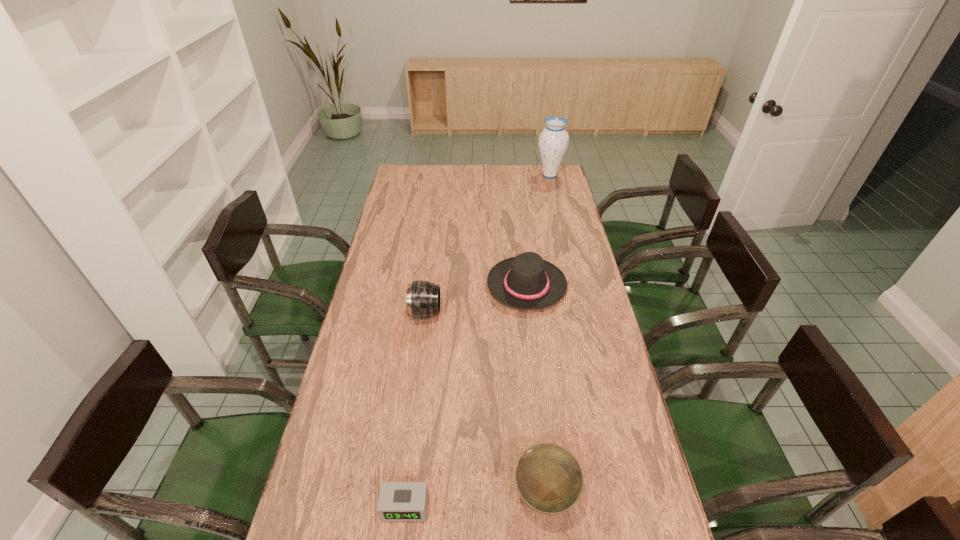
Where is `free area in between the bowl and the telephoto lens`? Image resolution: width=960 pixels, height=540 pixels. free area in between the bowl and the telephoto lens is located at coordinates (485, 404).

What are the coordinates of `vacant area between the dress hat and the bowl` in the screenshot? It's located at (x=536, y=390).

Find the location of `vacant space in between the bowl and the alarm clock`. vacant space in between the bowl and the alarm clock is located at coordinates (475, 501).

The height and width of the screenshot is (540, 960). I want to click on vacant space that is in between the bowl and the alarm clock, so click(475, 501).

You are a GUI agent. You are given a task and a screenshot of the screen. Output one action in this format:
    pyautogui.click(x=<x>, y=<y>)
    Task: Click on the vacant space that's between the vase and the bowl
    The image size is (960, 540).
    Given the screenshot: What is the action you would take?
    pyautogui.click(x=547, y=335)

You are a GUI agent. You are given a task and a screenshot of the screen. Output one action in this format:
    pyautogui.click(x=<x>, y=<y>)
    Task: Click on the free spot between the farthest object and the alarm clock
    This screenshot has height=540, width=960.
    Given the screenshot: What is the action you would take?
    pyautogui.click(x=477, y=341)

Locate an element on the screen. Image resolution: width=960 pixels, height=540 pixels. vacant space that's between the vase and the alarm clock is located at coordinates (477, 341).

The image size is (960, 540). Find the location of `unoccupied area between the bowl and the telephoto lens`. unoccupied area between the bowl and the telephoto lens is located at coordinates (485, 404).

Choose which object is the second nearest neighbor to the dress hat. Please provide its 2D coordinates. Your answer should be formatted as a tuple, i.e. [(x, y)], where the tuple contains the x and y coordinates of a point satisfying the conditions above.

[(549, 478)]

The image size is (960, 540). In order to click on object that is the third closest to the shortest object in this screenshot , I will do `click(527, 282)`.